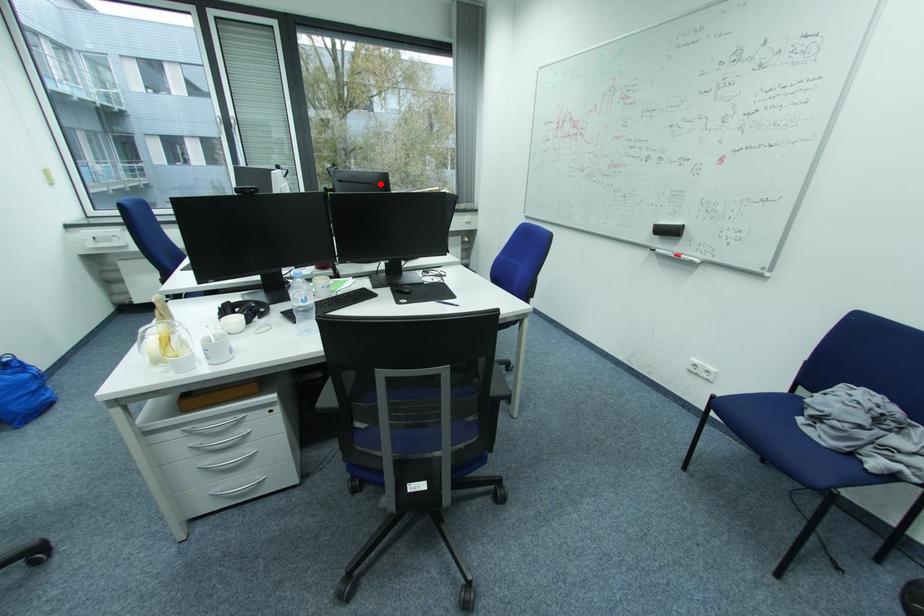
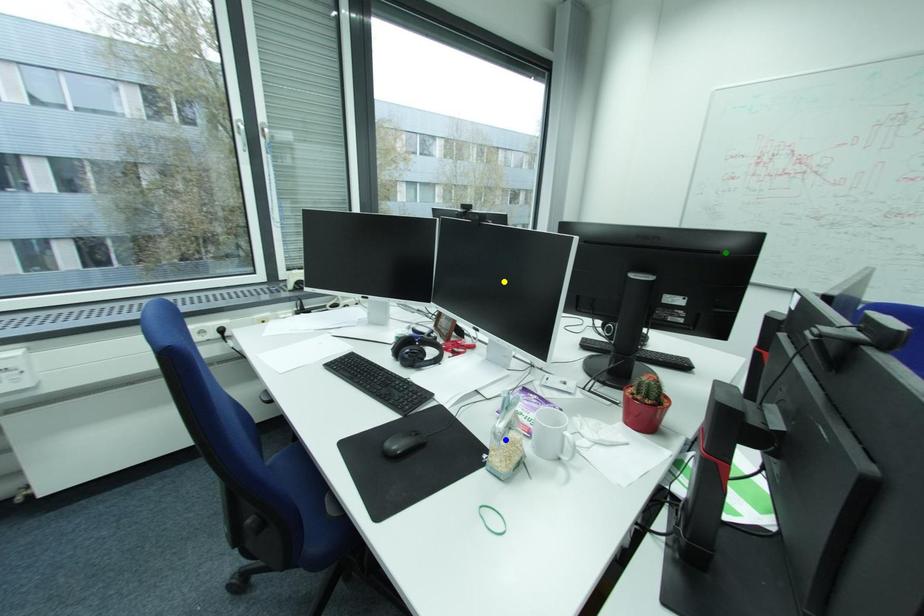
Question: I am providing you with two images of the same scene from different viewpoints. A red point is marked on the first image. You are given multiple points on the second image. Can you choose the point in image 2 that corresponds to the point in image 1?

Choices:
 (A) blue point
 (B) green point
 (C) yellow point

Answer: (B)